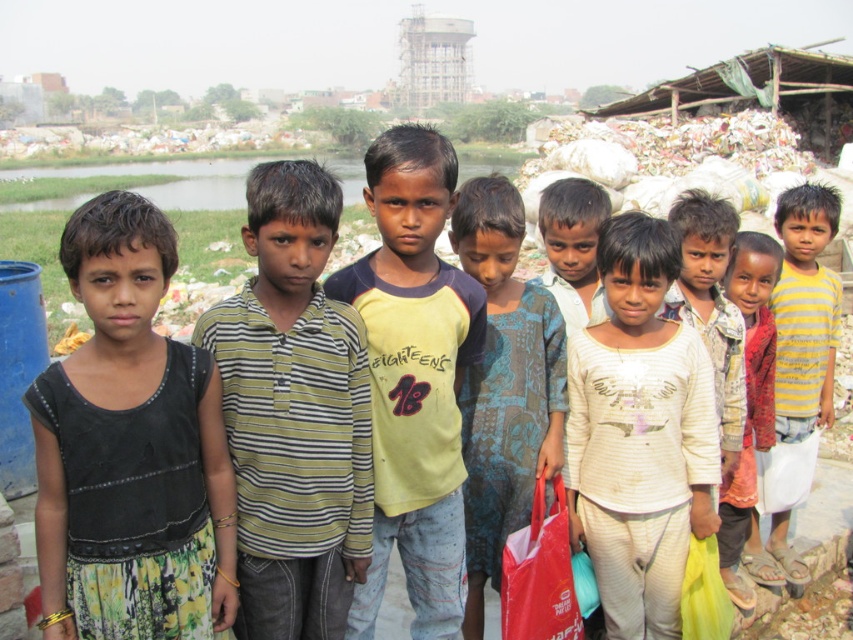
Question: Can you confirm if yellow cotton shirt at center is positioned to the right of yellow striped shirt at center?

Choices:
 (A) yes
 (B) no

Answer: (B)

Question: Can you confirm if white cotton shirt at center is positioned above light beige cotton shirt at center?

Choices:
 (A) no
 (B) yes

Answer: (A)

Question: Which of the following is the closest to the observer?

Choices:
 (A) (554, 212)
 (B) (273, 560)
 (C) (496, 369)
 (D) (602, 436)

Answer: (B)

Question: Can you confirm if white cotton shirt at center is wider than light beige cotton shirt at center?

Choices:
 (A) yes
 (B) no

Answer: (A)

Question: Which object appears farthest from the camera in this image?

Choices:
 (A) black fabric dress at left
 (B) yellow cotton shirt at center
 (C) yellow striped shirt at center

Answer: (C)

Question: Based on their relative distances, which object is nearer to the light beige cotton shirt at center?

Choices:
 (A) white striped shirt at center
 (B) blue patterned dress at center
 (C) white cotton shirt at center
 (D) yellow cotton shirt at center

Answer: (B)